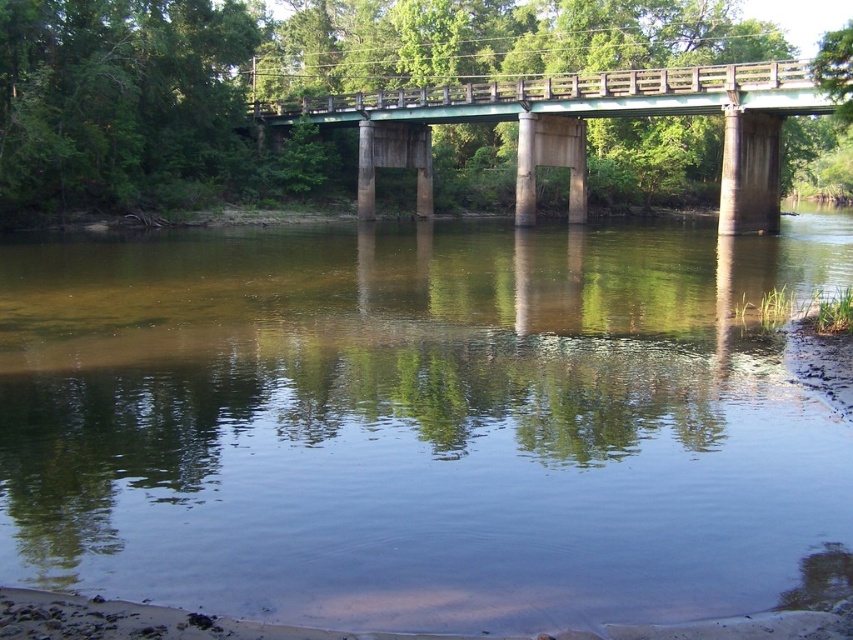
You are standing on the riverside path and want to take a photo of the clear water at center and the green concrete bridge at center. Which object should you focus on first to ensure it appears sharp in your photo?

You should focus on the clear water at center first because it is closer to the viewer than the green concrete bridge at center, so focusing on the closer object ensures it will be sharp.